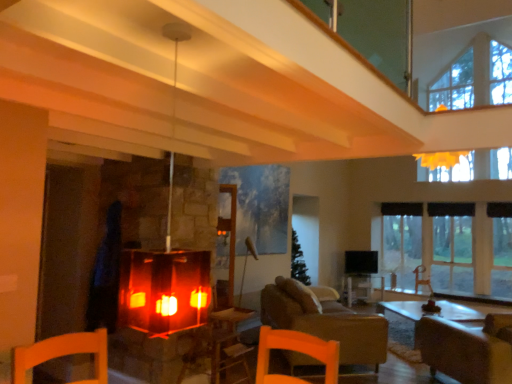
Question: Considering the relative positions of transparent glass window at right and black fabric curtain at right in the image provided, is transparent glass window at right in front of black fabric curtain at right?

Choices:
 (A) yes
 (B) no

Answer: (A)

Question: From a real-world perspective, is transparent glass window at right on black fabric curtain at right?

Choices:
 (A) no
 (B) yes

Answer: (A)

Question: Is transparent glass window at right not within black fabric curtain at right?

Choices:
 (A) no
 (B) yes

Answer: (B)

Question: Does transparent glass window at right appear on the left side of black fabric curtain at right?

Choices:
 (A) yes
 (B) no

Answer: (B)

Question: Is transparent glass window at right smaller than black fabric curtain at right?

Choices:
 (A) no
 (B) yes

Answer: (A)

Question: Does point (354, 294) appear closer or farther from the camera than point (395, 208)?

Choices:
 (A) closer
 (B) farther

Answer: (A)

Question: In the image, is wooden table at center positioned in front of or behind black fabric curtain at right?

Choices:
 (A) front
 (B) behind

Answer: (A)

Question: Looking at the image, does wooden table at center seem bigger or smaller compared to black fabric curtain at right?

Choices:
 (A) big
 (B) small

Answer: (A)

Question: From a real-world perspective, is wooden table at center physically located above or below black fabric curtain at right?

Choices:
 (A) below
 (B) above

Answer: (A)

Question: From a real-world perspective, is matte glass fireplace at center positioned above or below wooden table at center?

Choices:
 (A) above
 (B) below

Answer: (A)

Question: Considering the relative positions of matte glass fireplace at center and wooden table at center in the image provided, is matte glass fireplace at center to the left or to the right of wooden table at center?

Choices:
 (A) left
 (B) right

Answer: (A)

Question: Is matte glass fireplace at center situated inside wooden table at center or outside?

Choices:
 (A) outside
 (B) inside

Answer: (A)

Question: From the image's perspective, relative to wooden table at center, is matte glass fireplace at center above or below?

Choices:
 (A) above
 (B) below

Answer: (A)

Question: From the image's perspective, relative to matte glass fireplace at center, is wooden table at center above or below?

Choices:
 (A) below
 (B) above

Answer: (A)

Question: Visually, is wooden table at center positioned to the left or to the right of matte glass fireplace at center?

Choices:
 (A) left
 (B) right

Answer: (B)